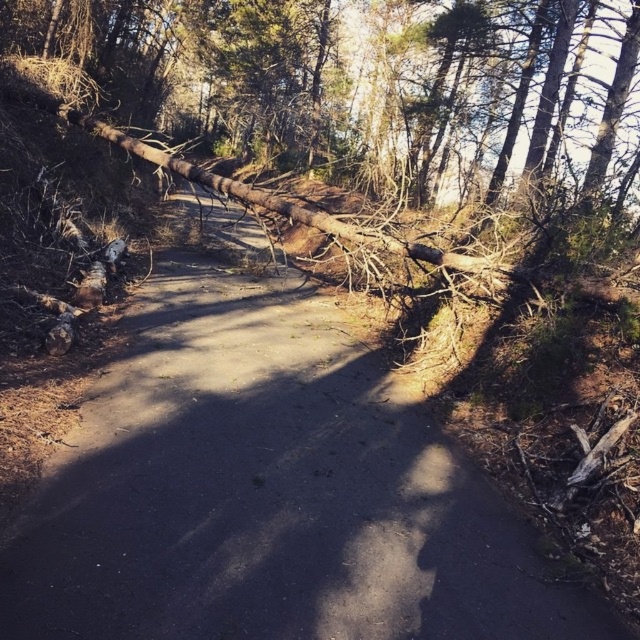
Question: In this image, where is brown dirt path at center located relative to brown rough log at upper center?

Choices:
 (A) above
 (B) below

Answer: (B)

Question: Is brown dirt path at center closer to the viewer compared to brown rough log at upper center?

Choices:
 (A) no
 (B) yes

Answer: (B)

Question: Which of the following is the farthest from the observer?

Choices:
 (A) brown rough log at upper center
 (B) brown dirt path at center

Answer: (A)

Question: Is brown dirt path at center closer to camera compared to brown rough log at upper center?

Choices:
 (A) no
 (B) yes

Answer: (B)

Question: Among these points, which one is farthest from the camera?

Choices:
 (A) (253, 67)
 (B) (477, 596)

Answer: (A)